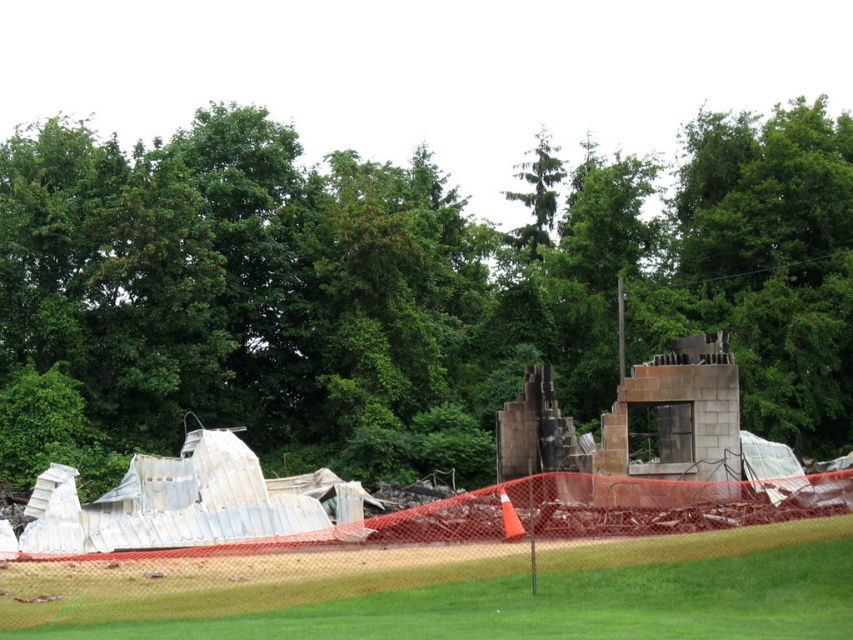
Question: Considering the relative positions of green leafy tree at upper center and green grass at lower center in the image provided, where is green leafy tree at upper center located with respect to green grass at lower center?

Choices:
 (A) below
 (B) above

Answer: (B)

Question: Observing the image, what is the correct spatial positioning of green leafy tree at upper center in reference to green grass at lower center?

Choices:
 (A) right
 (B) left

Answer: (B)

Question: Which point appears closest to the camera in this image?

Choices:
 (A) [x=643, y=545]
 (B) [x=846, y=212]

Answer: (A)

Question: Which point is farther to the camera?

Choices:
 (A) green leafy tree at upper center
 (B) green grass at lower center

Answer: (A)

Question: Is green leafy tree at upper center below green grass at lower center?

Choices:
 (A) yes
 (B) no

Answer: (B)